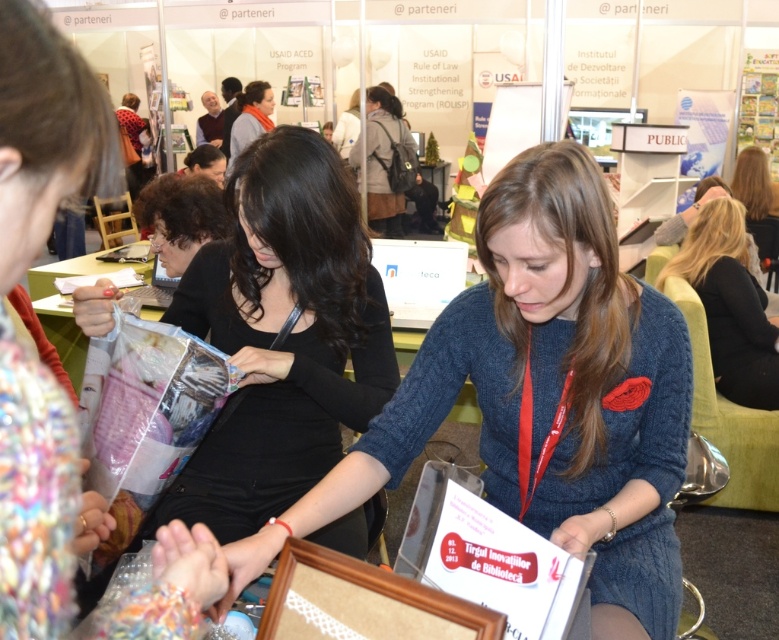
Question: Among these points, which one is nearest to the camera?

Choices:
 (A) (767, 368)
 (B) (335, 374)
 (C) (515, 156)

Answer: (C)

Question: Which point is closer to the camera taking this photo?

Choices:
 (A) (552, 164)
 (B) (16, 76)
 (C) (231, 323)
 (D) (439, 593)

Answer: (B)

Question: Estimate the real-world distances between objects in this image. Which object is closer to the blue knitted sweater at center?

Choices:
 (A) brown wooden picture frame at center
 (B) blonde hair at right

Answer: (A)

Question: Can you confirm if knitted sweater at center is thinner than brown wooden picture frame at center?

Choices:
 (A) yes
 (B) no

Answer: (B)

Question: Can you confirm if knitted sweater at center is positioned to the left of blonde hair at right?

Choices:
 (A) no
 (B) yes

Answer: (B)

Question: Is blue knitted sweater at center below black fabric bag at center?

Choices:
 (A) yes
 (B) no

Answer: (A)